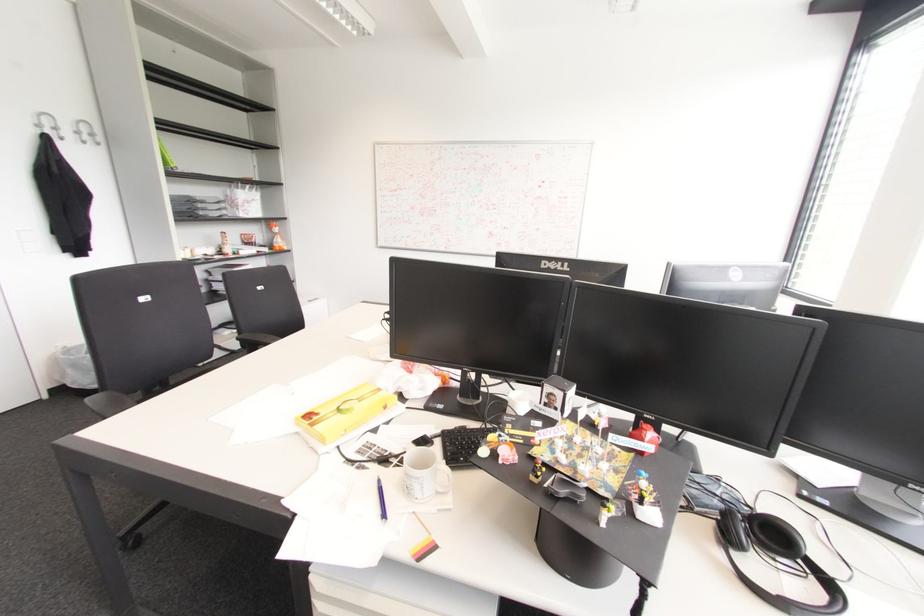
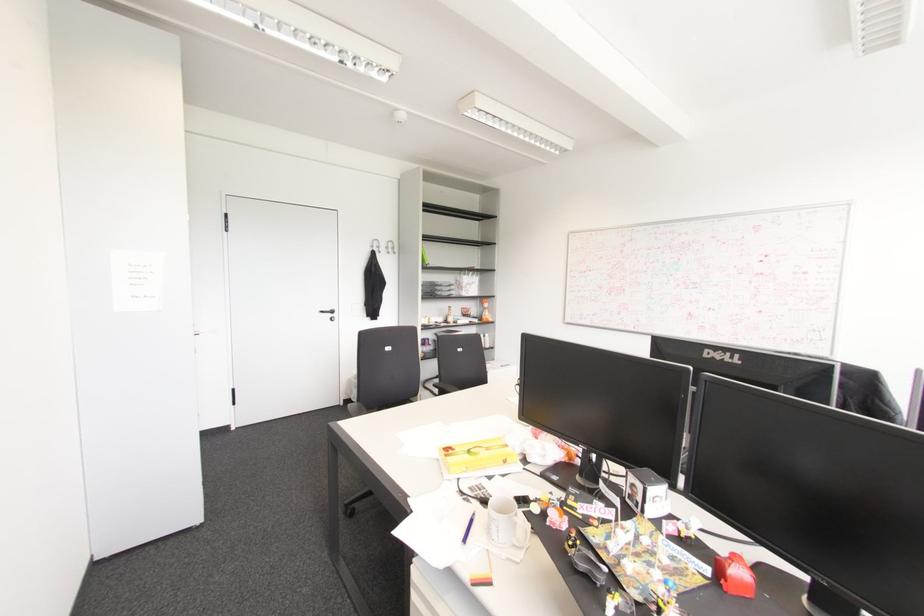
The point at (383, 407) is marked in the first image. Where is the corresponding point in the second image?

(504, 461)